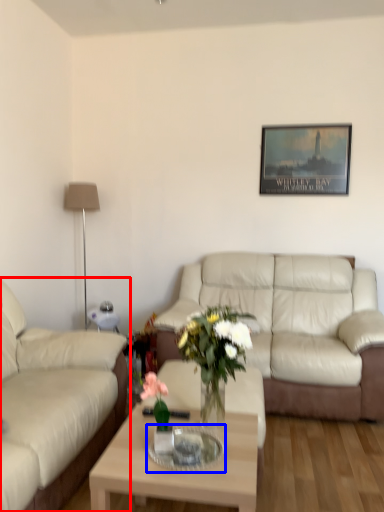
Question: Which object appears farthest to the camera in this image, studio couch (highlighted by a red box) or glass table (highlighted by a blue box)?

Choices:
 (A) studio couch
 (B) glass table

Answer: (B)